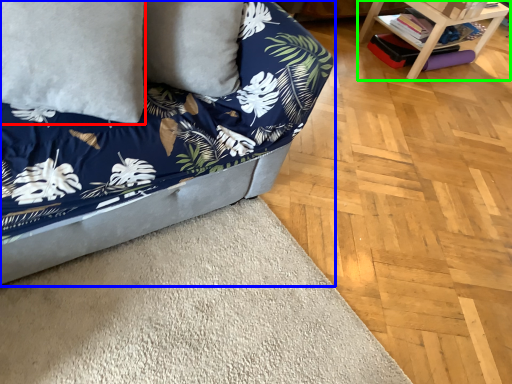
Question: Which is farther away from pillow (highlighted by a red box)? studio couch (highlighted by a blue box) or table (highlighted by a green box)?

Choices:
 (A) studio couch
 (B) table

Answer: (B)